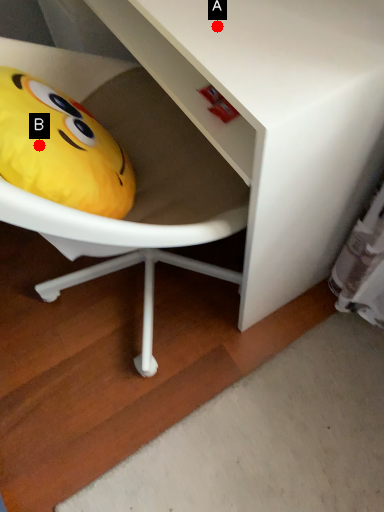
Question: Two points are circled on the image, labeled by A and B beside each circle. Which point is further to the camera?

Choices:
 (A) A is further
 (B) B is further

Answer: (B)